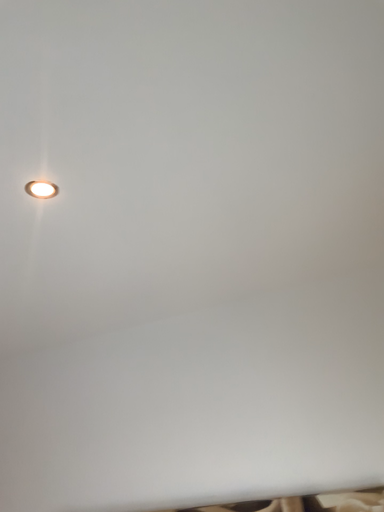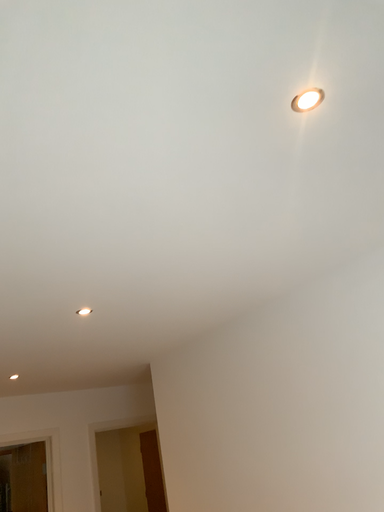
Question: Which way did the camera rotate in the video?

Choices:
 (A) rotated left
 (B) rotated right

Answer: (A)